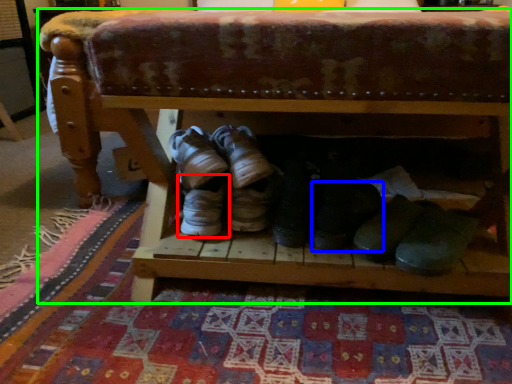
Question: Which is farther away from footwear (highlighted by a red box)? footwear (highlighted by a blue box) or furniture (highlighted by a green box)?

Choices:
 (A) footwear
 (B) furniture

Answer: (B)